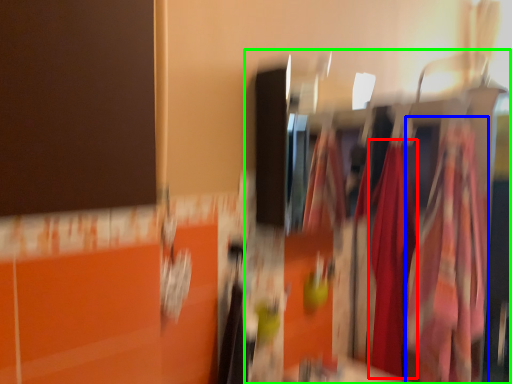
Question: Considering the real-world distances, which object is closest to clothing (highlighted by a red box)? clothing (highlighted by a blue box) or closet (highlighted by a green box).

Choices:
 (A) clothing
 (B) closet

Answer: (B)